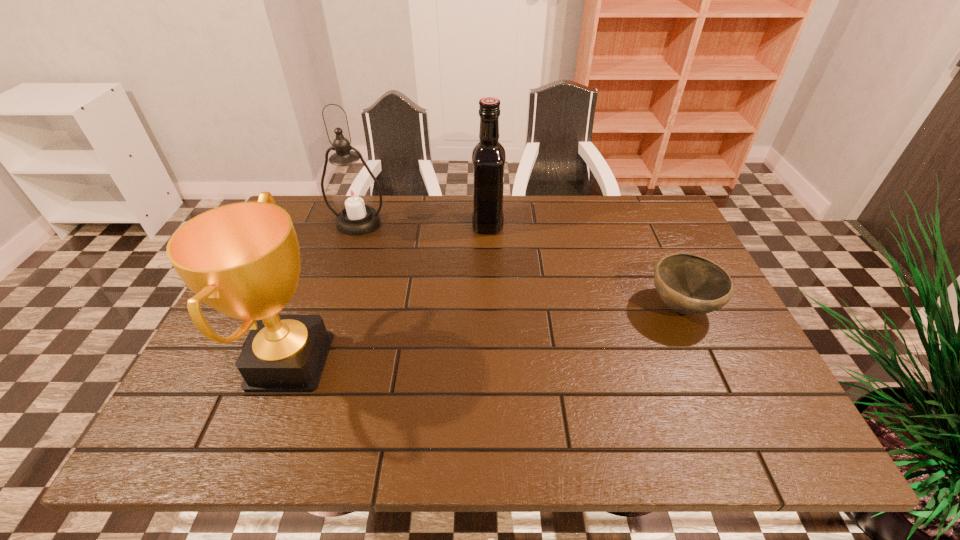
Identify the location of liquor. The height and width of the screenshot is (540, 960). (488, 156).

Identify the location of oil lamp. This screenshot has width=960, height=540. (352, 194).

Locate an element on the screen. This screenshot has width=960, height=540. award is located at coordinates point(242,259).

Find the location of `the rightmost object`. the rightmost object is located at coordinates (688, 284).

Locate an element on the screen. The image size is (960, 540). bowl is located at coordinates (688, 284).

Where is `vacant region located on the front-facing side of the third object from left to right`? vacant region located on the front-facing side of the third object from left to right is located at coordinates tap(416, 224).

Image resolution: width=960 pixels, height=540 pixels. What are the coordinates of `blank area located on the front-facing side of the third object from left to right` in the screenshot? It's located at (349, 224).

Identify the location of free space located on the front-facing side of the third object from left to right. Image resolution: width=960 pixels, height=540 pixels. (433, 224).

The image size is (960, 540). What are the coordinates of `free space located 0.360m on the front of the oil lamp` in the screenshot? It's located at (322, 330).

I want to click on free space located 0.090m on the front-facing side of the award, so click(x=375, y=361).